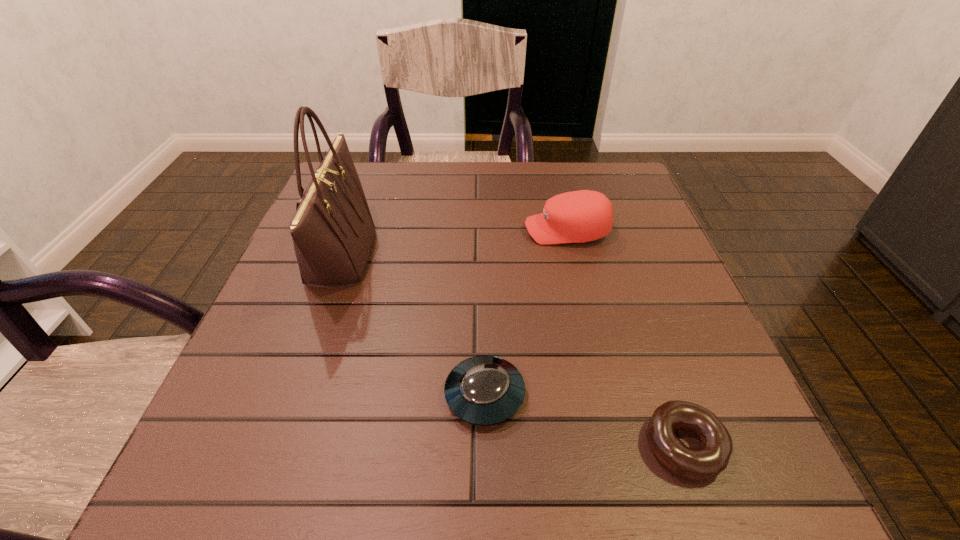
Where is `empty space that is in between the cap and the doughnut`? This screenshot has height=540, width=960. empty space that is in between the cap and the doughnut is located at coordinates (625, 338).

Find the location of a particular element. vacant space in between the second object from left to right and the doughnut is located at coordinates (584, 420).

Where is `vacant region between the doughnut and the second object from left to right`? This screenshot has height=540, width=960. vacant region between the doughnut and the second object from left to right is located at coordinates (584, 420).

What are the coordinates of `vacant area that lies between the handbag and the third object from right to left` in the screenshot? It's located at (413, 325).

Locate an element on the screen. The width and height of the screenshot is (960, 540). the third closest object relative to the doughnut is located at coordinates (333, 232).

Find the location of a particular element. the third closest object to the second object from left to right is located at coordinates (581, 216).

In order to click on vacant space that satisfies the following two spatial constraints: 1. on the front-facing side of the tallest object; 2. on the back side of the doughnut in this screenshot , I will do `click(274, 445)`.

Where is `free space that satisfies the following two spatial constraints: 1. on the front-facing side of the second tallest object; 2. on the back side of the doughnut`? free space that satisfies the following two spatial constraints: 1. on the front-facing side of the second tallest object; 2. on the back side of the doughnut is located at coordinates (618, 445).

Where is `vacant space that satisfies the following two spatial constraints: 1. on the front-facing side of the second tallest object; 2. on the back side of the doughnut`? This screenshot has width=960, height=540. vacant space that satisfies the following two spatial constraints: 1. on the front-facing side of the second tallest object; 2. on the back side of the doughnut is located at coordinates (618, 445).

You are a GUI agent. You are given a task and a screenshot of the screen. Output one action in this format:
    pyautogui.click(x=<x>, y=<y>)
    Task: Click on the vacant space that satisfies the following two spatial constraints: 1. on the front-facing side of the handbag; 2. on the right side of the saucer
    
    Given the screenshot: What is the action you would take?
    pyautogui.click(x=291, y=395)